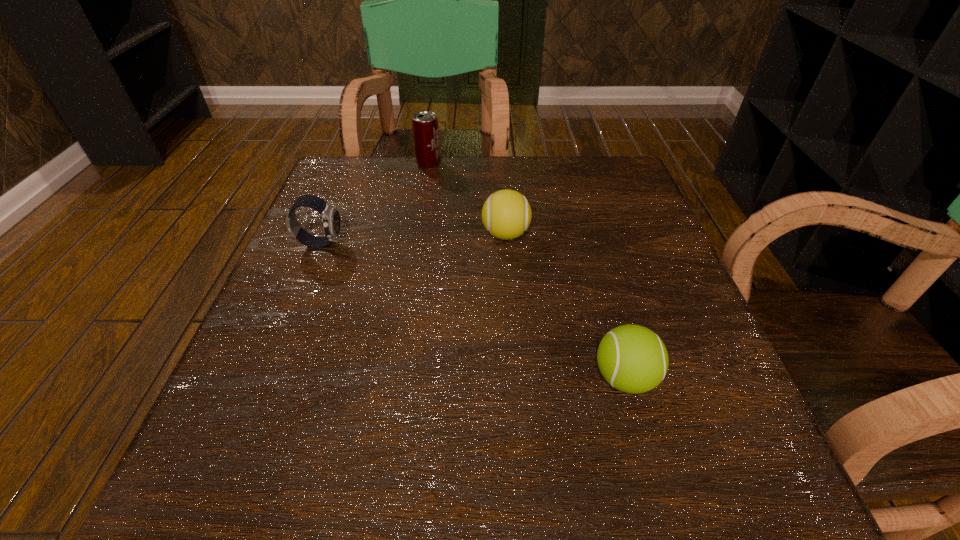
Locate an element on the screen. The height and width of the screenshot is (540, 960). free space at the far right corner of the desktop is located at coordinates (600, 161).

The width and height of the screenshot is (960, 540). I want to click on vacant area at the near right corner of the desktop, so click(734, 465).

Locate an element on the screen. This screenshot has height=540, width=960. empty space between the rightmost object and the watch is located at coordinates tap(472, 310).

The width and height of the screenshot is (960, 540). I want to click on free space between the farther tennis ball and the rightmost object, so click(x=565, y=306).

Locate an element on the screen. empty space that is in between the leftmost object and the left tennis ball is located at coordinates (413, 239).

The image size is (960, 540). In order to click on unoccupied position between the farther tennis ball and the rightmost object in this screenshot , I will do `click(565, 306)`.

You are a GUI agent. You are given a task and a screenshot of the screen. Output one action in this format:
    pyautogui.click(x=<x>, y=<y>)
    Task: Click on the empty space between the left tennis ball and the farthest object
    The height and width of the screenshot is (540, 960).
    Given the screenshot: What is the action you would take?
    pyautogui.click(x=468, y=199)

Locate an element on the screen. This screenshot has height=540, width=960. vacant point located between the right tennis ball and the third object from left to right is located at coordinates (565, 306).

The image size is (960, 540). What are the coordinates of `free spot between the rightmost object and the watch` in the screenshot? It's located at (472, 310).

Locate an element on the screen. The height and width of the screenshot is (540, 960). free space between the second object from right to left and the watch is located at coordinates (413, 239).